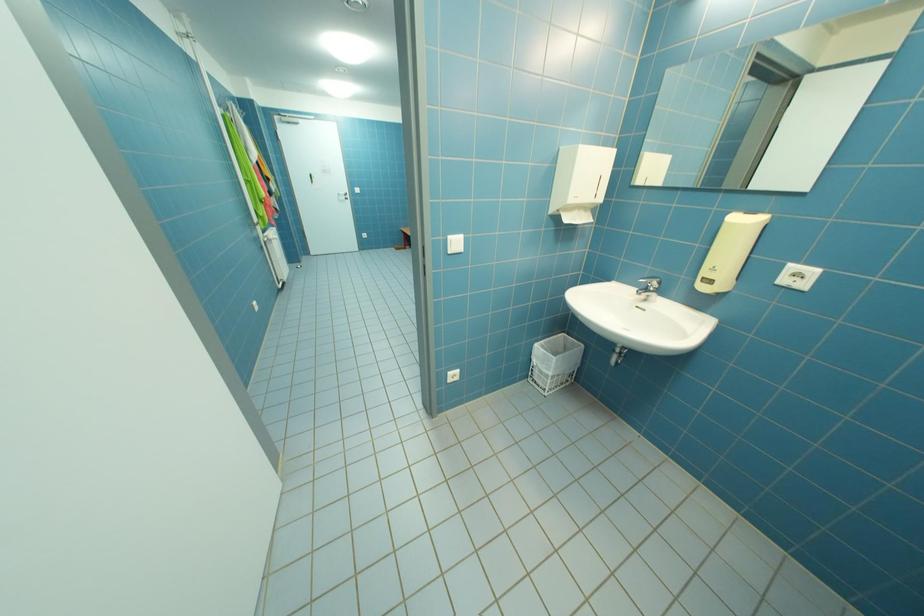
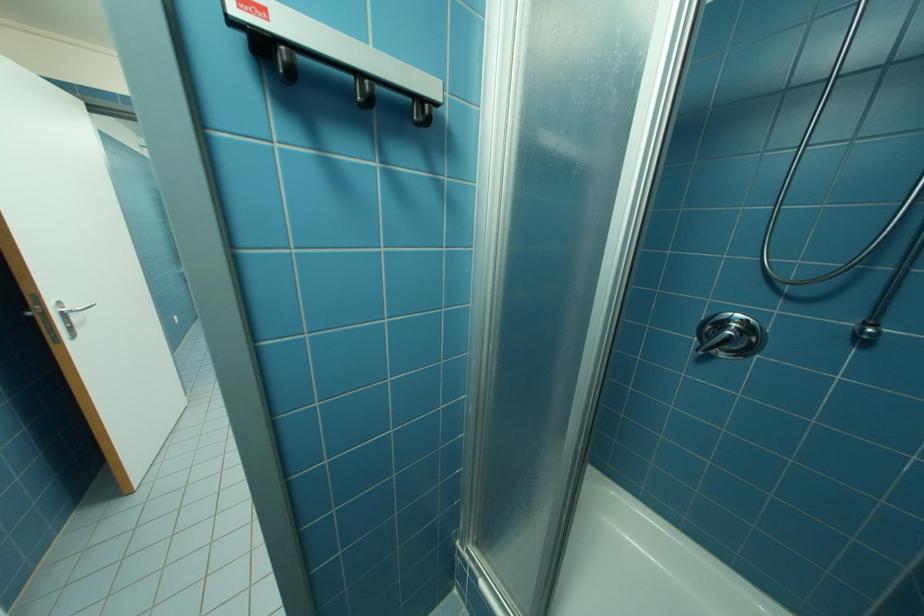
Which direction would the cameraman need to move to produce the second image?

The movement direction of the cameraman is right, backward.